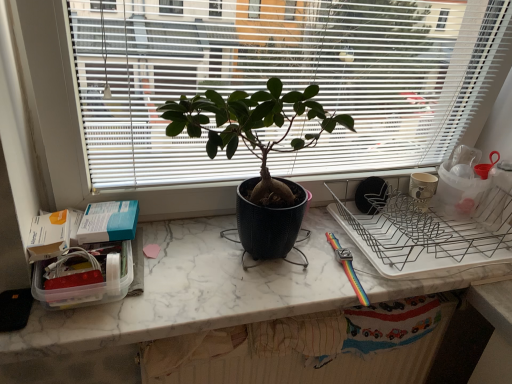
Image resolution: width=512 pixels, height=384 pixels. In order to click on vacant space underneath matte black pot at center (from a real-world perspective) in this screenshot , I will do `click(253, 274)`.